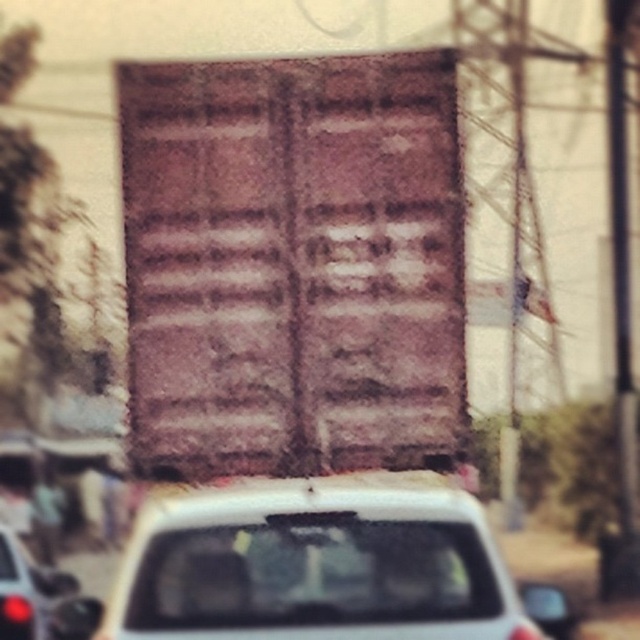
Question: Which object appears closest to the camera in this image?

Choices:
 (A) metallic silver car at lower left
 (B) white matte car at center

Answer: (B)

Question: Does white matte car at center have a smaller size compared to metallic silver car at lower left?

Choices:
 (A) no
 (B) yes

Answer: (A)

Question: Which point appears farthest from the camera in this image?

Choices:
 (A) (205, 627)
 (B) (4, 561)

Answer: (B)

Question: Does white matte car at center appear on the left side of metallic silver car at lower left?

Choices:
 (A) yes
 (B) no

Answer: (B)

Question: Can you confirm if white matte car at center is smaller than metallic silver car at lower left?

Choices:
 (A) no
 (B) yes

Answer: (A)